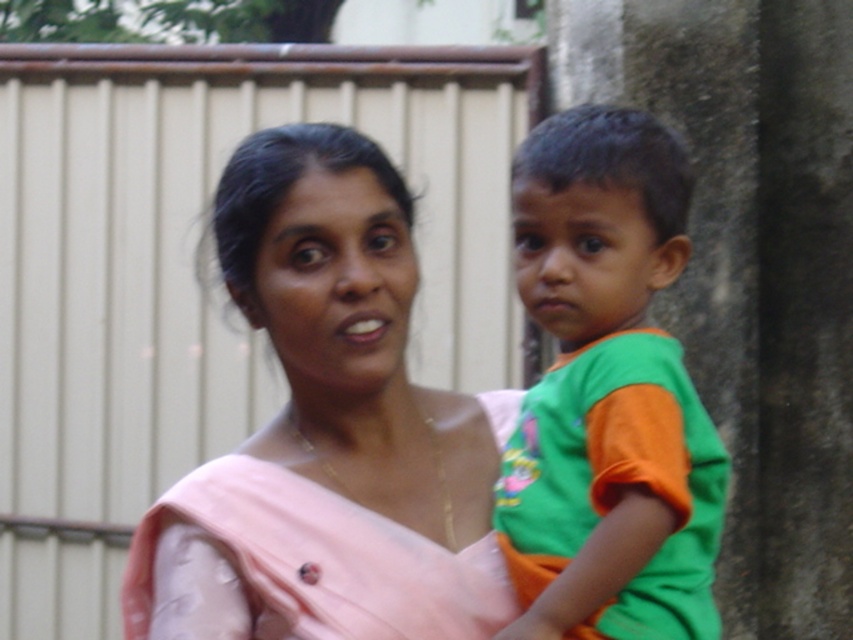
Question: Does pink fabric at center have a greater width compared to green cotton shirt at center?

Choices:
 (A) yes
 (B) no

Answer: (A)

Question: Does pink fabric at center lie in front of green cotton shirt at center?

Choices:
 (A) no
 (B) yes

Answer: (A)

Question: Which object appears farthest from the camera in this image?

Choices:
 (A) pink fabric at center
 (B) green cotton shirt at center

Answer: (A)

Question: Does pink fabric at center appear on the right side of green cotton shirt at center?

Choices:
 (A) yes
 (B) no

Answer: (B)